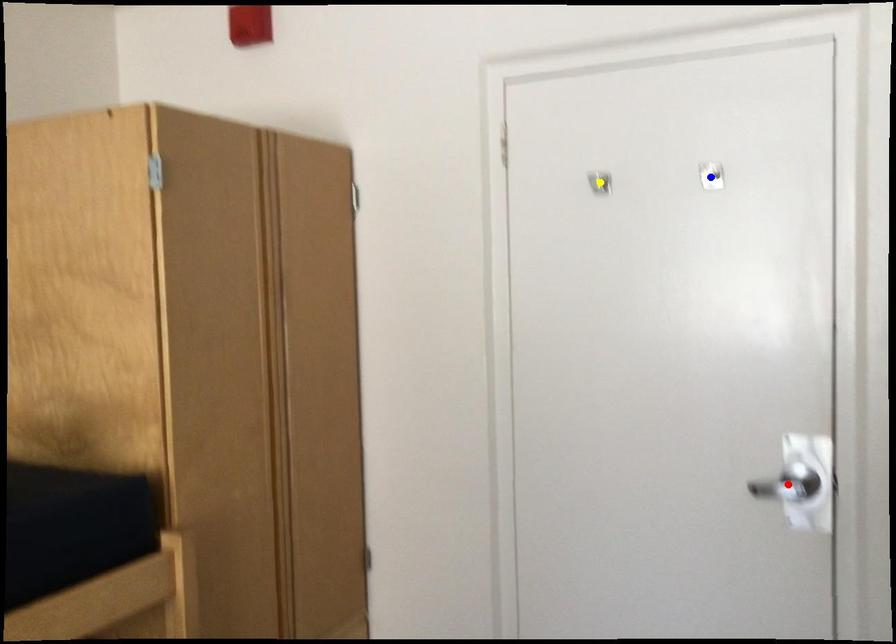
Order these from nearest to farthest:
A) blue point
B) yellow point
C) red point

red point → blue point → yellow point